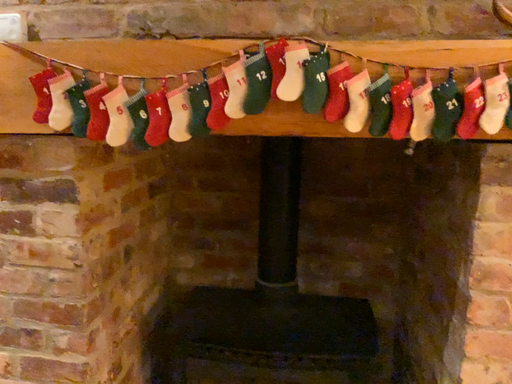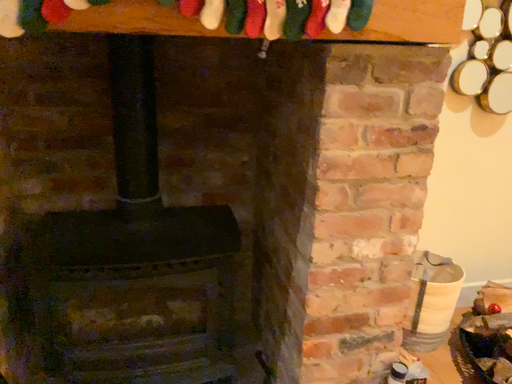
Question: How did the camera likely rotate when shooting the video?

Choices:
 (A) rotated upward
 (B) rotated downward

Answer: (B)